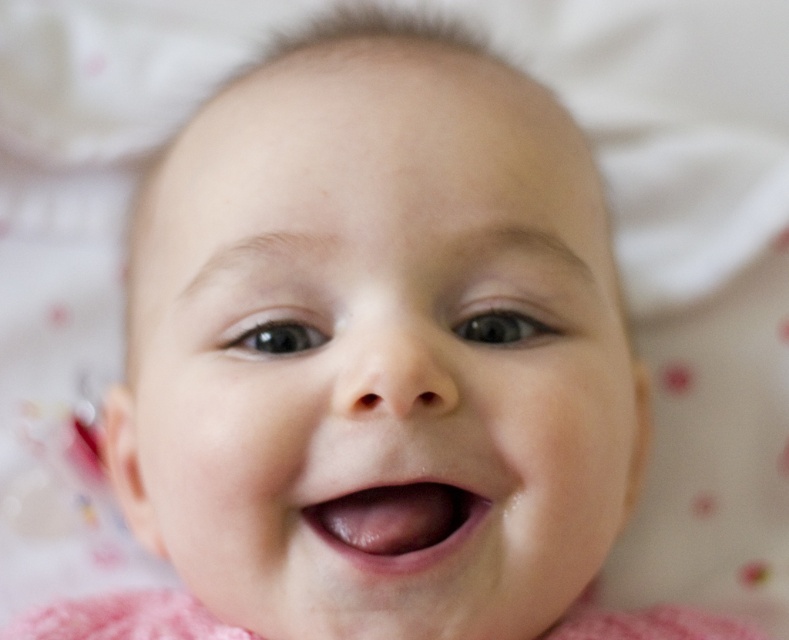
Based on the scene, can you determine which object is wider between the smooth skin baby at center and the pink glossy lips at center?

The smooth skin baby at center is wider than the pink glossy lips at center.

Based on the scene, which object is larger in height between the smooth skin baby at center and the pink glossy lips at center?

The smooth skin baby at center is much taller as pink glossy lips at center.